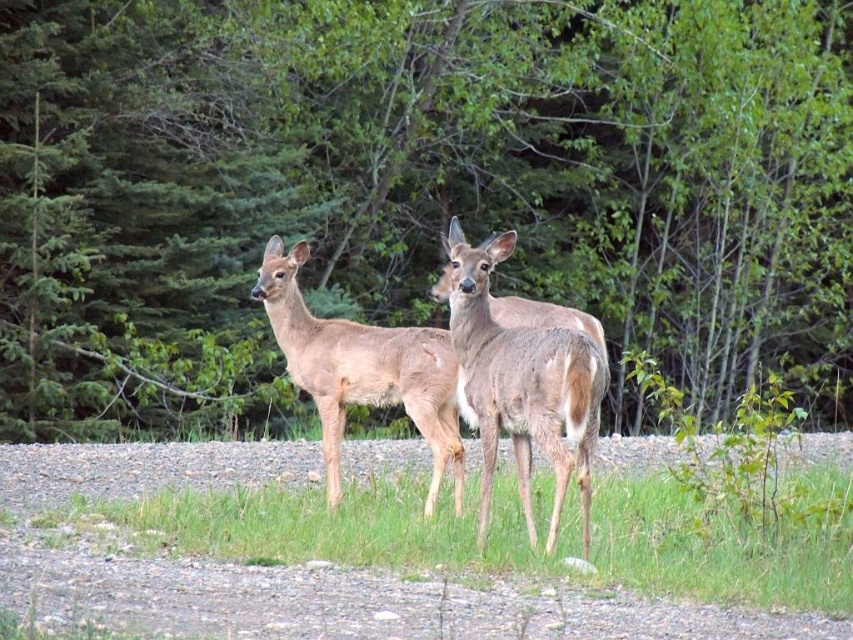
You are a hiker who wants to take a photo of the brown matte fur at center and the green leafy forest at center. Which object should you focus on first if you want both to be in sharp focus?

The green leafy forest at center is bigger than brown matte fur at center, so you should focus on the green leafy forest at center first to ensure both are in sharp focus.

You are a hiker who wants to place a camera trap between the two points, point [364,108] and point [527,342]. Which point is closer to you so you can place the camera trap there?

Point [364,108] is further to the viewer than point [527,342]. Therefore, point [527,342] is closer to you, so you should place the camera trap there.